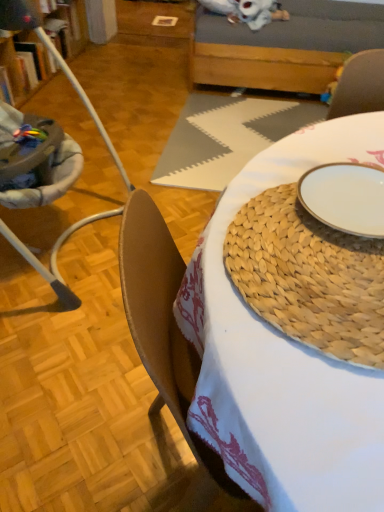
Find the location of a particular element. Image resolution: width=384 pixels, height=512 pixels. free area below brown leather chair at left (from a real-world perspective) is located at coordinates (56, 242).